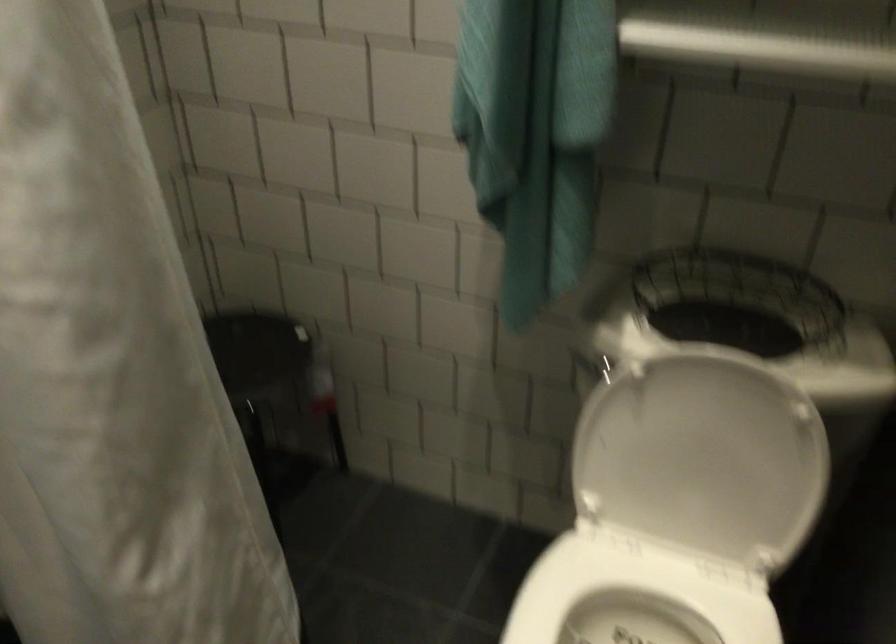
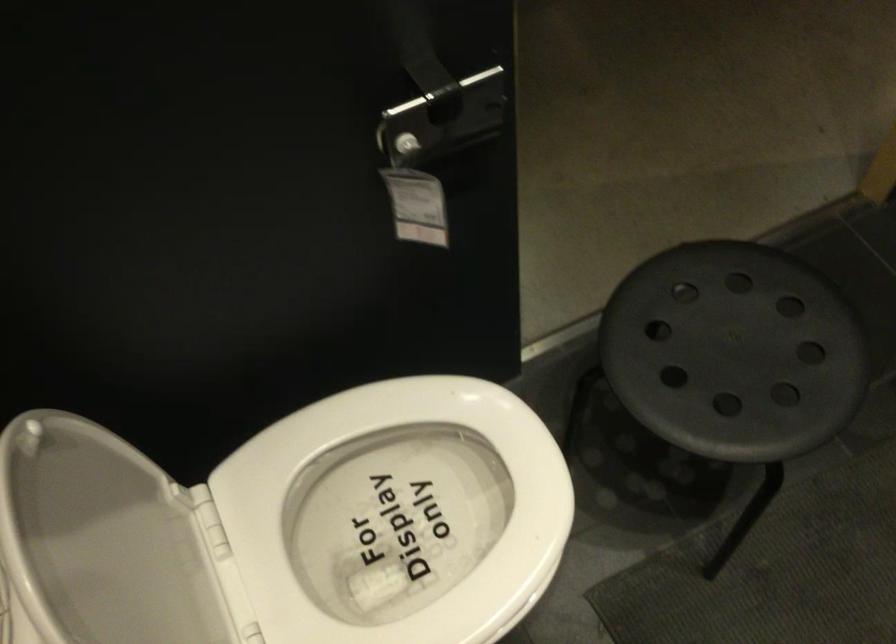
Locate, in the second image, the point that corresponds to point 685,491 in the first image.

(100, 540)